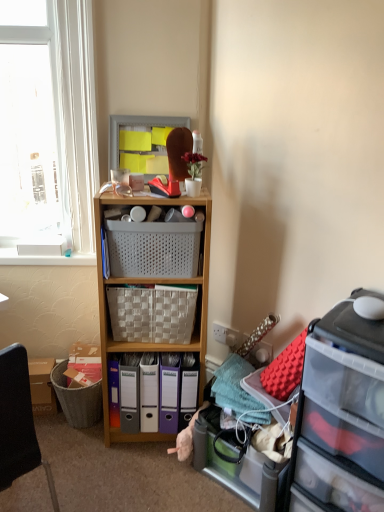
This screenshot has width=384, height=512. Describe the element at coordinates (194, 163) in the screenshot. I see `white matte vase at upper center` at that location.

Based on the photo, measure the distance between white plastic basket at center, acting as the first picnic basket starting from the top, and camera.

The depth of white plastic basket at center, acting as the first picnic basket starting from the top, is 1.45 meters.

Describe the element at coordinates (77, 399) in the screenshot. I see `gray textured trash bin at lower left` at that location.

Locate an element on the screen. The image size is (384, 512). white matte vase at upper center is located at coordinates (194, 163).

From a real-world perspective, is white matte vase at upper center located higher than matte plastic bin at center, placed as the third bin when sorted from right to left?

Yes.

From the picture: Considering the relative sizes of white matte vase at upper center and matte plastic bin at center, placed as the third bin when sorted from right to left, in the image provided, is white matte vase at upper center thinner than matte plastic bin at center, placed as the third bin when sorted from right to left,?

Yes, white matte vase at upper center is thinner than matte plastic bin at center, placed as the third bin when sorted from right to left.

Which of these two, white matte vase at upper center or matte plastic bin at center, placed as the third bin when sorted from right to left, is smaller?

With smaller size is white matte vase at upper center.

Does white matte vase at upper center touch matte plastic bin at center, placed as the third bin when sorted from right to left?

There is a gap between white matte vase at upper center and matte plastic bin at center, placed as the third bin when sorted from right to left.

How much distance is there between wooden cabinet at center and matte plastic bin at center, the second bin in the left-to-right sequence?

8.74 inches.

Which is more to the left, wooden cabinet at center or matte plastic bin at center, the second bin in the left-to-right sequence?

From the viewer's perspective, matte plastic bin at center, the second bin in the left-to-right sequence, appears more on the left side.

Is wooden cabinet at center positioned with its back to matte plastic bin at center, the second bin in the left-to-right sequence?

Yes.

Can you confirm if wooden cabinet at center is shorter than matte plastic bin at center, which ranks as the 2th bin in right-to-left order?

Incorrect, the height of wooden cabinet at center does not fall short of that of matte plastic bin at center, which ranks as the 2th bin in right-to-left order.

From the image's perspective, would you say matte plastic bin at center, which appears as the 1th bin when viewed from the left, is shown under translucent plastic storage box at lower right?

No, from the image's perspective, matte plastic bin at center, which appears as the 1th bin when viewed from the left, is not beneath translucent plastic storage box at lower right.

Relative to translucent plastic storage box at lower right, is matte plastic bin at center, placed as the third bin when sorted from right to left, in front or behind?

matte plastic bin at center, placed as the third bin when sorted from right to left, is behind translucent plastic storage box at lower right.

Is matte plastic bin at center, which appears as the 1th bin when viewed from the left, to the left of translucent plastic storage box at lower right from the viewer's perspective?

Yes, matte plastic bin at center, which appears as the 1th bin when viewed from the left, is to the left of translucent plastic storage box at lower right.

Is there a large distance between matte plastic bin at center, placed as the third bin when sorted from right to left, and translucent plastic storage box at lower right?

No, there isn't a large distance between matte plastic bin at center, placed as the third bin when sorted from right to left, and translucent plastic storage box at lower right.

Does point (59, 379) come farther from viewer compared to point (132, 307)?

That is True.

Considering the sizes of objects gray textured trash bin at lower left and woven beige picnic basket at center, the second picnic basket in the top-to-bottom sequence, in the image provided, who is thinner, gray textured trash bin at lower left or woven beige picnic basket at center, the second picnic basket in the top-to-bottom sequence,?

With smaller width is gray textured trash bin at lower left.

Is the depth of gray textured trash bin at lower left less than that of woven beige picnic basket at center, the second picnic basket in the top-to-bottom sequence?

No, gray textured trash bin at lower left is further to the viewer.

Can woven beige picnic basket at center, the second picnic basket in the top-to-bottom sequence, be found inside gray textured trash bin at lower left?

That's incorrect, woven beige picnic basket at center, the second picnic basket in the top-to-bottom sequence, is not inside gray textured trash bin at lower left.

This screenshot has width=384, height=512. I want to click on bin above the matte plastic bin at center, the second bin in the left-to-right sequence (from the image's perspective), so click(129, 392).

Are matte plastic bin at center, placed as the third bin when sorted from right to left, and matte plastic bin at center, which ranks as the 2th bin in right-to-left order, far apart?

That's not correct — matte plastic bin at center, placed as the third bin when sorted from right to left, is a little close to matte plastic bin at center, which ranks as the 2th bin in right-to-left order.

Is matte plastic bin at center, which appears as the 1th bin when viewed from the left, oriented towards matte plastic bin at center, which ranks as the 2th bin in right-to-left order?

No, matte plastic bin at center, which appears as the 1th bin when viewed from the left, does not turn towards matte plastic bin at center, which ranks as the 2th bin in right-to-left order.

From the image's perspective, is matte plastic bin at center, placed as the third bin when sorted from right to left, positioned above or below matte plastic bin at center, the second bin in the left-to-right sequence?

matte plastic bin at center, placed as the third bin when sorted from right to left, is situated higher than matte plastic bin at center, the second bin in the left-to-right sequence, in the image.

Is matte plastic bin at center, the second bin in the left-to-right sequence, wider or thinner than matte plastic bin at center, which appears as the 1th bin when viewed from the left?

In the image, matte plastic bin at center, the second bin in the left-to-right sequence, appears to be wider than matte plastic bin at center, which appears as the 1th bin when viewed from the left.

Locate an element on the screen. The width and height of the screenshot is (384, 512). bin on the left side of matte plastic bin at center, which ranks as the 2th bin in right-to-left order is located at coordinates (129, 392).

Between matte plastic bin at center, which ranks as the 2th bin in right-to-left order, and matte plastic bin at center, placed as the third bin when sorted from right to left, which one appears on the left side from the viewer's perspective?

Positioned to the left is matte plastic bin at center, placed as the third bin when sorted from right to left.

At what (x,y) coordinates should I click in order to perform the action: click on picnic basket beneath the white plastic basket at center, the second picnic basket in the bottom-to-top sequence (from a real-world perspective). Please return your answer as a coordinate pair (x, y). The height and width of the screenshot is (512, 384). Looking at the image, I should click on (152, 313).

Considering the relative positions of white plastic basket at center, acting as the first picnic basket starting from the top, and woven beige picnic basket at center, the second picnic basket in the top-to-bottom sequence, in the image provided, is white plastic basket at center, acting as the first picnic basket starting from the top, to the left or to the right of woven beige picnic basket at center, the second picnic basket in the top-to-bottom sequence,?

In the image, white plastic basket at center, acting as the first picnic basket starting from the top, appears on the right side of woven beige picnic basket at center, the second picnic basket in the top-to-bottom sequence.

Do you think white plastic basket at center, the second picnic basket in the bottom-to-top sequence, is within woven beige picnic basket at center, which ranks as the 1th picnic basket in bottom-to-top order, or outside of it?

white plastic basket at center, the second picnic basket in the bottom-to-top sequence, is spatially situated outside woven beige picnic basket at center, which ranks as the 1th picnic basket in bottom-to-top order.

Considering the relative sizes of white plastic basket at center, acting as the first picnic basket starting from the top, and woven beige picnic basket at center, which ranks as the 1th picnic basket in bottom-to-top order, in the image provided, is white plastic basket at center, acting as the first picnic basket starting from the top, smaller than woven beige picnic basket at center, which ranks as the 1th picnic basket in bottom-to-top order,?

Yes.

Find the location of a particular element. Image resolution: width=384 pixels, height=512 pixels. flower in front of the matte plastic bin at center, placed as the third bin when sorted from right to left is located at coordinates (194, 163).

Find the location of a particular element. cabinetry located above the matte plastic bin at center, which ranks as the 2th bin in right-to-left order (from the image's perspective) is located at coordinates (154, 343).

Considering their positions, is matte plastic bin at center, the second bin in the left-to-right sequence, positioned closer to white plastic window at upper left than translucent plastic storage box at lower right?

Based on the image, matte plastic bin at center, the second bin in the left-to-right sequence, appears to be nearer to white plastic window at upper left.

In the scene shown: Considering their positions, is translucent plastic storage box at lower right positioned closer to matte plastic bin at center, which appears as the 1th bin when viewed from the left, than white plastic power outlet at center?

translucent plastic storage box at lower right.

From the image, which object appears to be nearer to woven beige picnic basket at center, the second picnic basket in the top-to-bottom sequence, matte plastic cabinet at upper center or white plastic basket at center, the second picnic basket in the bottom-to-top sequence?

white plastic basket at center, the second picnic basket in the bottom-to-top sequence.

Estimate the real-world distances between objects in this image. Which object is further from matte plastic cabinet at upper center, white plastic power outlet at center or wooden cabinet at center?

white plastic power outlet at center lies further to matte plastic cabinet at upper center than the other object.

Estimate the real-world distances between objects in this image. Which object is closer to white matte vase at upper center, matte plastic cabinet at upper center or white plastic basket at center, acting as the first picnic basket starting from the top?

The object closer to white matte vase at upper center is matte plastic cabinet at upper center.

Looking at this image, when comparing their distances from matte plastic bin at center, which ranks as the 2th bin in right-to-left order, does white plastic window at upper left or matte plastic cabinet at upper center seem closer?

matte plastic cabinet at upper center lies closer to matte plastic bin at center, which ranks as the 2th bin in right-to-left order, than the other object.

Looking at the image, which one is located further to gray textured trash bin at lower left, wooden cabinet at center or white plastic window at upper left?

white plastic window at upper left lies further to gray textured trash bin at lower left than the other object.

Considering their positions, is white matte vase at upper center positioned further to gray textured trash bin at lower left than woven beige picnic basket at center, which ranks as the 1th picnic basket in bottom-to-top order?

white matte vase at upper center lies further to gray textured trash bin at lower left than the other object.

Identify the location of power outlet between white plastic window at upper left and matte plastic bin at center, the second bin in the left-to-right sequence, from top to bottom. The height and width of the screenshot is (512, 384). point(226,335).

Find the location of a particular element. flower between clear plastic drawer at right and white plastic power outlet at center in the front-back direction is located at coordinates (194, 163).

The height and width of the screenshot is (512, 384). In order to click on window sill between white plastic window at upper left and matte plastic bin at center, placed as the third bin when sorted from right to left, in the vertical direction in this screenshot , I will do [x=45, y=259].

The height and width of the screenshot is (512, 384). I want to click on window sill between white plastic window at upper left and wooden cabinet at center vertically, so click(45, 259).